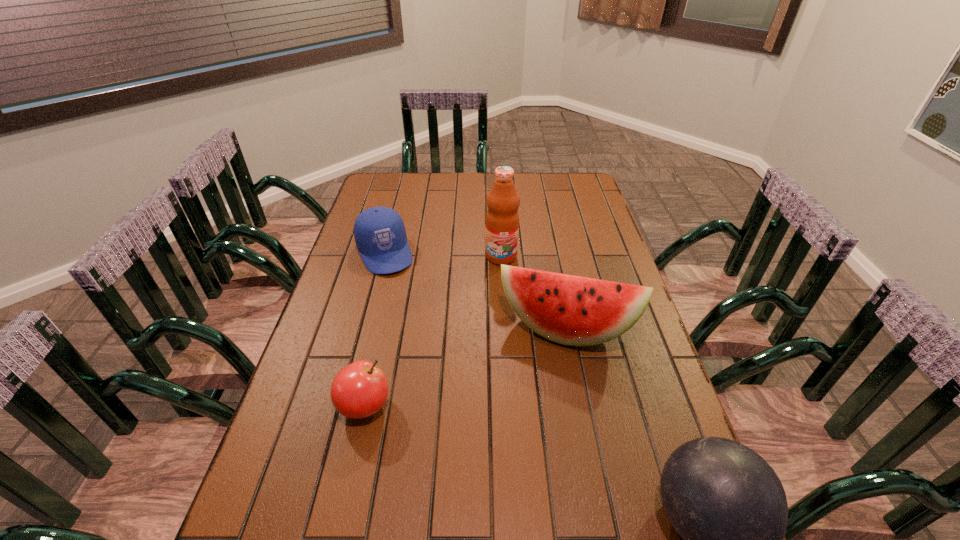
Where is `vacant point at the far left corner`? This screenshot has height=540, width=960. vacant point at the far left corner is located at coordinates (392, 188).

The width and height of the screenshot is (960, 540). I want to click on vacant area between the apple and the cap, so click(374, 329).

Find the location of a particular element. This screenshot has height=540, width=960. free space between the apple and the third nearest object is located at coordinates (465, 367).

Locate which object ranks fourth in proximity to the bowling ball. Please provide its 2D coordinates. Your answer should be formatted as a tuple, i.e. [(x, y)], where the tuple contains the x and y coordinates of a point satisfying the conditions above.

[(379, 232)]

Point out which object is positioned as the fourth nearest to the fourth farthest object. Please provide its 2D coordinates. Your answer should be formatted as a tuple, i.e. [(x, y)], where the tuple contains the x and y coordinates of a point satisfying the conditions above.

[(729, 506)]